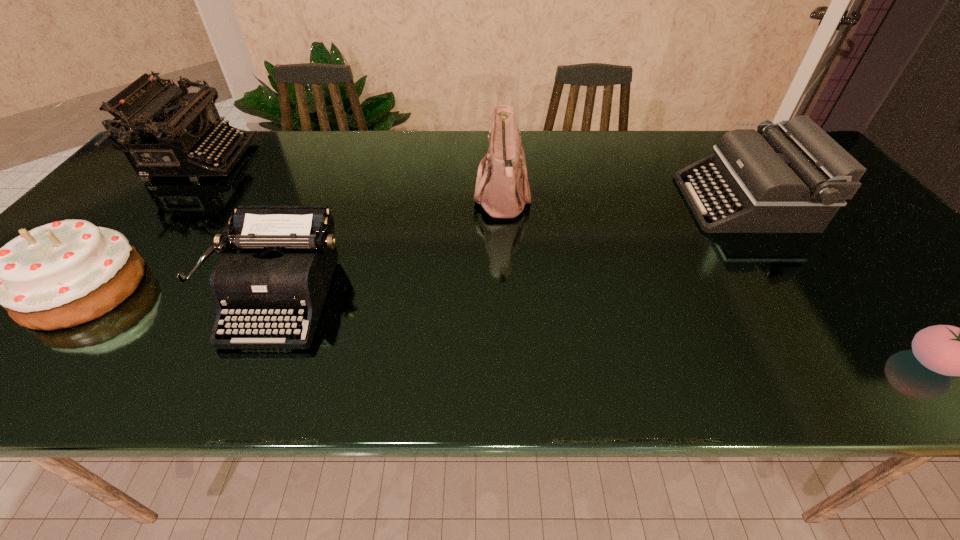
The height and width of the screenshot is (540, 960). I want to click on free region at the left edge, so click(150, 194).

In the image, there is a desktop. Where is `free space at the right edge`? This screenshot has width=960, height=540. free space at the right edge is located at coordinates (841, 237).

The height and width of the screenshot is (540, 960). In order to click on vacant area that lies between the shoulder bag and the second shortest typewriter in this screenshot , I will do `click(623, 200)`.

You are a GUI agent. You are given a task and a screenshot of the screen. Output one action in this format:
    pyautogui.click(x=<x>, y=<y>)
    Task: Click on the free space between the second typewriter from left to right and the fourth object from left to right
    
    Given the screenshot: What is the action you would take?
    pyautogui.click(x=392, y=247)

At what (x,y) coordinates should I click in order to perform the action: click on free area in between the tallest typewriter and the second tallest typewriter. Please return your answer as a coordinate pair (x, y). Looking at the image, I should click on (471, 181).

Where is `vacant area that lies between the third object from right to left and the rightmost typewriter`? The height and width of the screenshot is (540, 960). vacant area that lies between the third object from right to left and the rightmost typewriter is located at coordinates (623, 200).

Locate an element on the screen. This screenshot has width=960, height=540. the fifth closest object relative to the shoulder bag is located at coordinates (948, 350).

Identify the location of object that is the fourth closest to the rightmost typewriter. The height and width of the screenshot is (540, 960). (164, 131).

At what (x,y) coordinates should I click in order to perform the action: click on typewriter object that ranks as the closest to the shoulder bag. Please return your answer as a coordinate pair (x, y). Looking at the image, I should click on (288, 254).

At what (x,y) coordinates should I click in order to perform the action: click on the third closest typewriter to the shoulder bag. Please return your answer as a coordinate pair (x, y). This screenshot has height=540, width=960. Looking at the image, I should click on (164, 131).